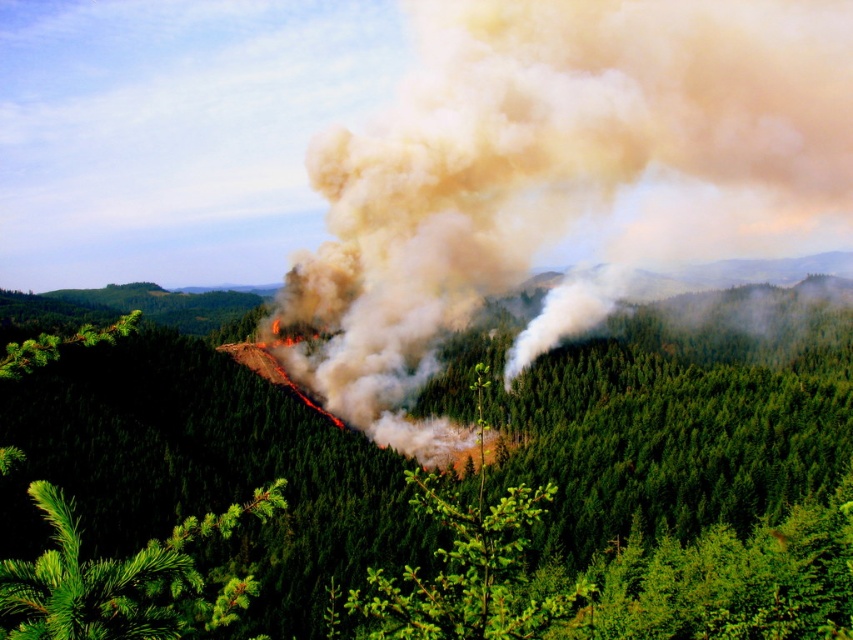
Who is higher up, green textured tree at center or green leafy tree at center?

green textured tree at center is above.

Does point (229, 429) come farther from viewer compared to point (514, 515)?

Yes, point (229, 429) is farther from viewer.

The image size is (853, 640). In order to click on green textured tree at center in this screenshot , I will do `click(679, 486)`.

Does smoke cloud at center have a smaller size compared to green leafy tree at center?

No.

This screenshot has height=640, width=853. Describe the element at coordinates (561, 176) in the screenshot. I see `smoke cloud at center` at that location.

Where is `smoke cloud at center`? smoke cloud at center is located at coordinates (561, 176).

Is smoke cloud at center further to camera compared to green needle-like at center?

Yes.

Does smoke cloud at center appear on the left side of green needle-like at center?

In fact, smoke cloud at center is to the right of green needle-like at center.

This screenshot has width=853, height=640. What do you see at coordinates (561, 176) in the screenshot?
I see `smoke cloud at center` at bounding box center [561, 176].

Where is `smoke cloud at center`? The height and width of the screenshot is (640, 853). smoke cloud at center is located at coordinates (561, 176).